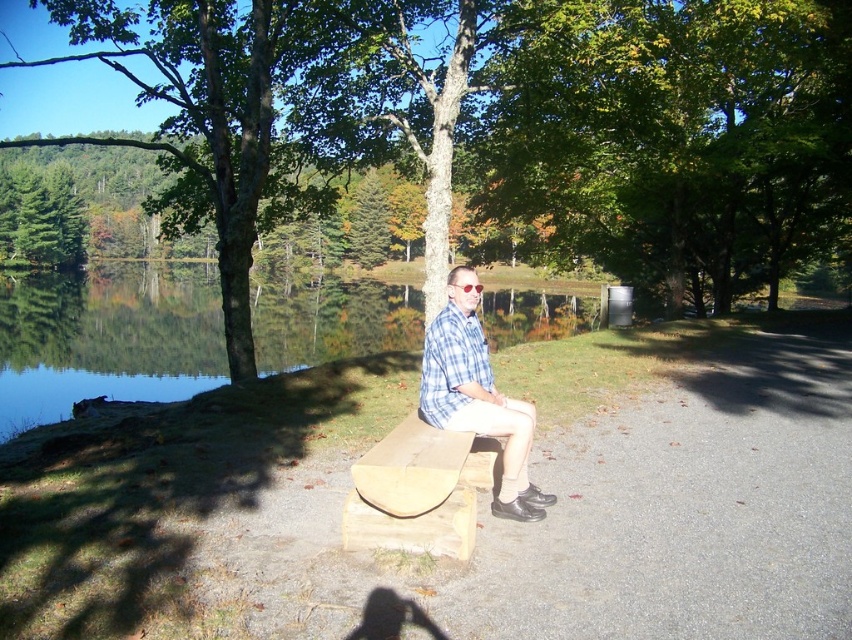
Question: Is green textured tree at center positioned in front of blue plaid shirt at center?

Choices:
 (A) yes
 (B) no

Answer: (B)

Question: Which of the following is the closest to the observer?

Choices:
 (A) (577, 221)
 (B) (354, 509)

Answer: (B)

Question: Considering the real-world distances, which object is farthest from the clear water at bench left?

Choices:
 (A) green textured tree at center
 (B) blue plaid shirt at center
 (C) light brown wooden bench at center

Answer: (B)

Question: Does green textured tree at center appear under clear water at bench left?

Choices:
 (A) no
 (B) yes

Answer: (A)

Question: Estimate the real-world distances between objects in this image. Which object is closer to the blue plaid shirt at center?

Choices:
 (A) light brown wooden bench at center
 (B) clear water at bench left
 (C) green textured tree at center

Answer: (A)

Question: Can you confirm if light brown wooden bench at center is positioned below blue plaid shirt at center?

Choices:
 (A) no
 (B) yes

Answer: (B)